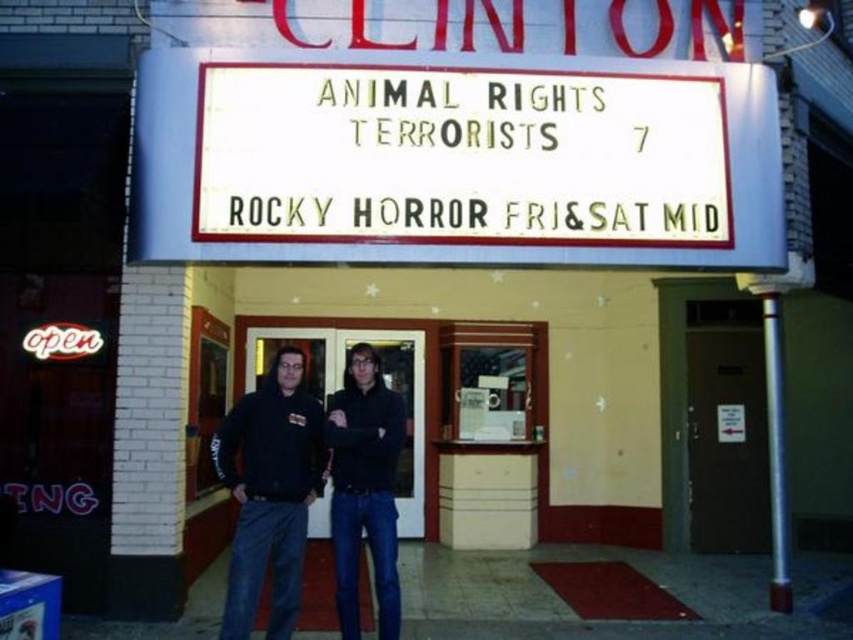
You are standing at the entrance of the Clinton theater and see a point marked at coordinates (x=270, y=493). According to the scene description, which object is located at that point?

The point at coordinates (x=270, y=493) is located on the black hoodie at center.

You are at the entrance of the Clinton Theater and see two points marked on the ground. The first point is at coordinate point (277, 481) and the second point is at coordinate point (370, 364). Which point is closer to the theater entrance?

Point (277, 481) is in front of point (370, 364), so it is closer to the theater entrance.